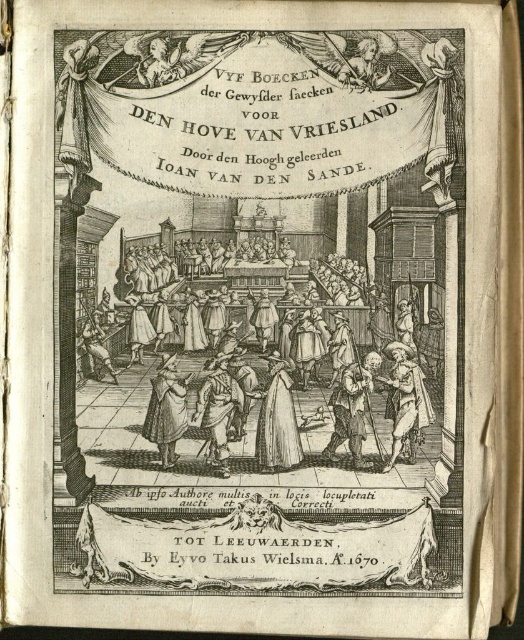
You are an assistant in a museum and a visitor asks, while looking at the engraving, where exactly the brown leather coat at center is located in the image. Use the coordinate system where the bottom left corner is the origin point. What do you tell them?

The brown leather coat at center is located at coordinates point (217, 410).

In the historical engraving described, there is a white paper dress at center and a smooth white statue at upper center. From the perspective of someone standing at the entrance of the grand hall, which object is positioned to the left?

The white paper dress at center is to the left of the smooth white statue at upper center from the viewer standing at the entrance.